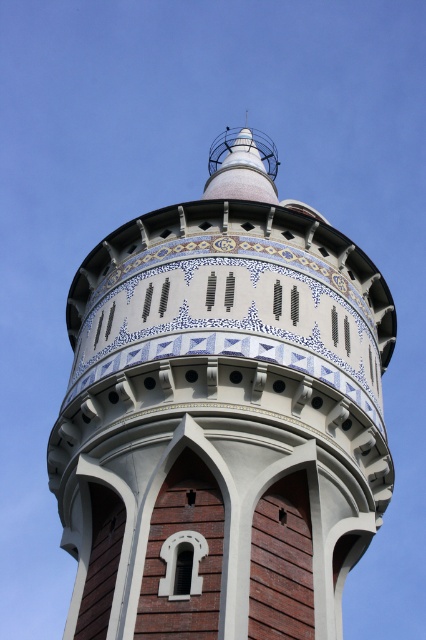
Question: Which point is closer to the camera?

Choices:
 (A) white ceramic tower at center
 (B) white glossy spire at upper center

Answer: (A)

Question: Is white ceramic tower at center above white glossy spire at upper center?

Choices:
 (A) no
 (B) yes

Answer: (A)

Question: Is white ceramic tower at center wider than white glossy spire at upper center?

Choices:
 (A) yes
 (B) no

Answer: (A)

Question: Which point is closer to the camera?

Choices:
 (A) white ceramic tower at center
 (B) white glossy spire at upper center

Answer: (A)

Question: Which point is closer to the camera?

Choices:
 (A) white glossy spire at upper center
 (B) white ceramic tower at center

Answer: (B)

Question: Is white ceramic tower at center closer to the viewer compared to white glossy spire at upper center?

Choices:
 (A) yes
 (B) no

Answer: (A)